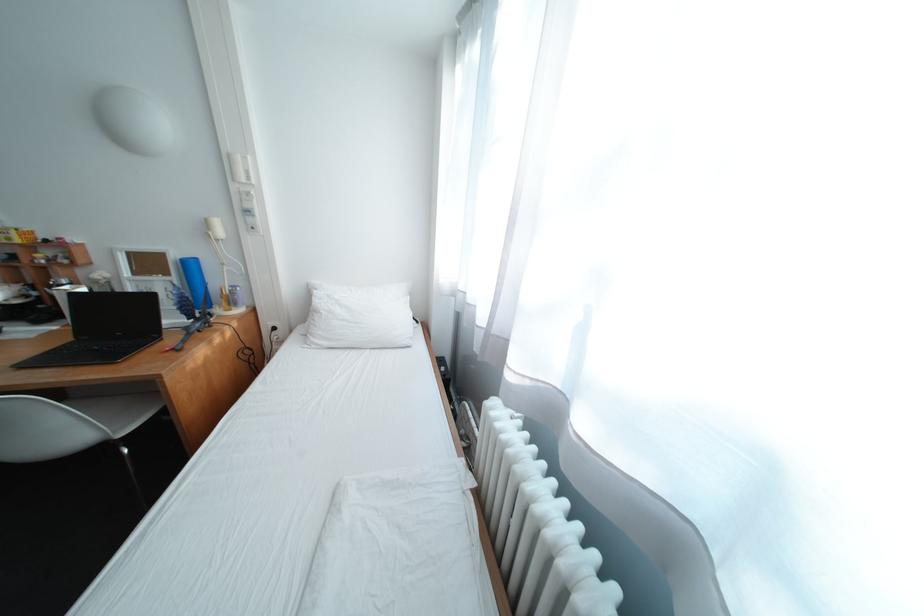
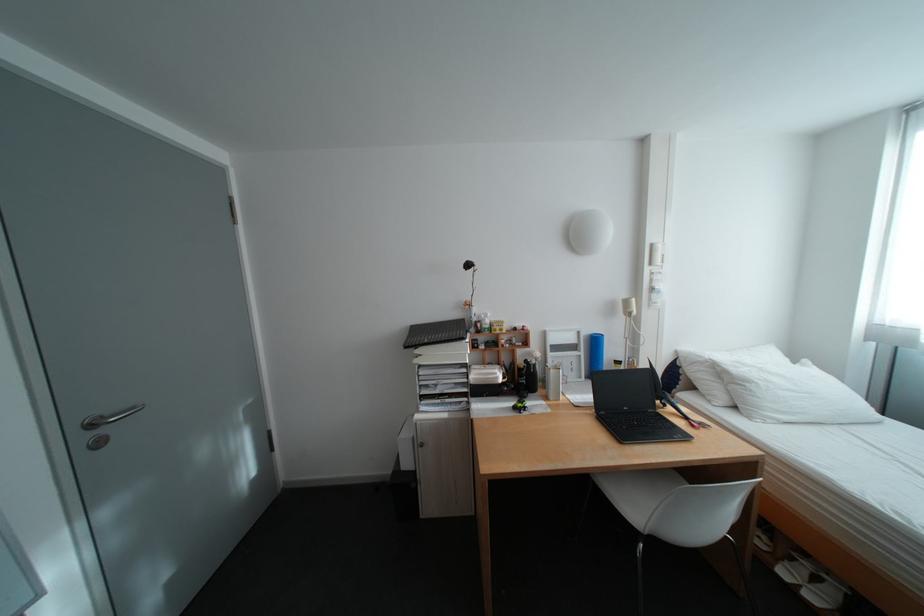
The point at (242,156) is marked in the first image. Where is the corresponding point in the second image?

(664, 246)